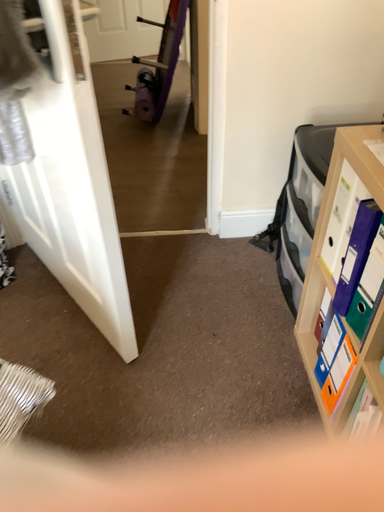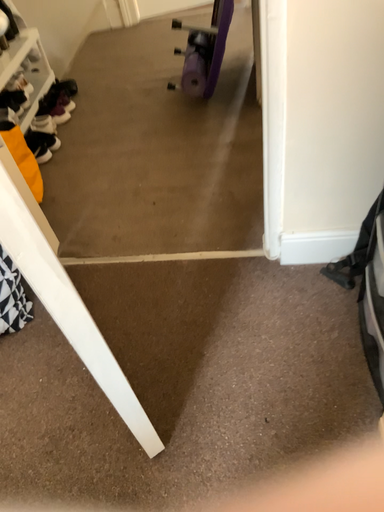
Question: Which way did the camera rotate in the video?

Choices:
 (A) rotated right
 (B) rotated left

Answer: (B)